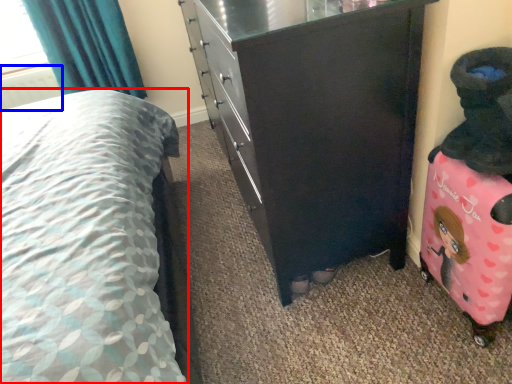
Question: Which object appears farthest to the camera in this image, bed (highlighted by a red box) or radiator (highlighted by a blue box)?

Choices:
 (A) bed
 (B) radiator

Answer: (B)